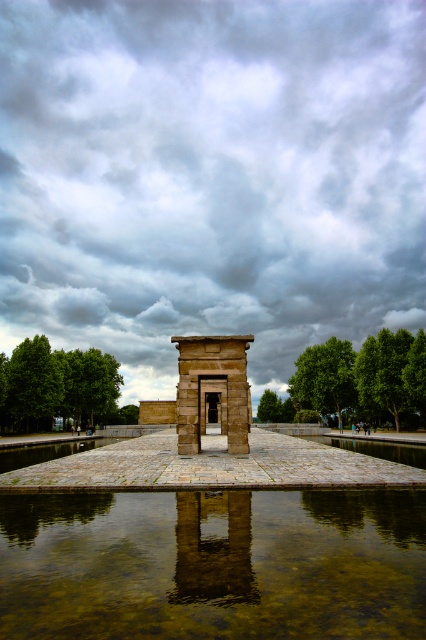
Question: Is cloudy sky at upper center positioned behind clear water at center?

Choices:
 (A) yes
 (B) no

Answer: (A)

Question: Which object is farther from the camera taking this photo?

Choices:
 (A) stone temple at center
 (B) cloudy sky at upper center
 (C) clear water at center

Answer: (B)

Question: Which point appears farthest from the camera in this image?

Choices:
 (A) (169, 522)
 (B) (325, 280)
 (C) (209, 365)

Answer: (B)

Question: Is cloudy sky at upper center bigger than clear water at center?

Choices:
 (A) yes
 (B) no

Answer: (A)

Question: Does cloudy sky at upper center have a lesser width compared to stone temple at center?

Choices:
 (A) no
 (B) yes

Answer: (A)

Question: Among these objects, which one is nearest to the camera?

Choices:
 (A) cloudy sky at upper center
 (B) stone temple at center

Answer: (B)